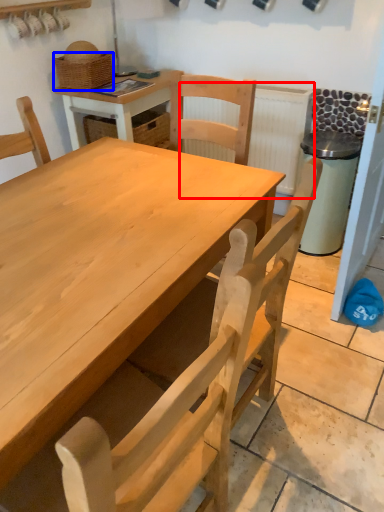
Question: Which object is further to the camera taking this photo, radiator (highlighted by a red box) or basket (highlighted by a blue box)?

Choices:
 (A) radiator
 (B) basket

Answer: (A)